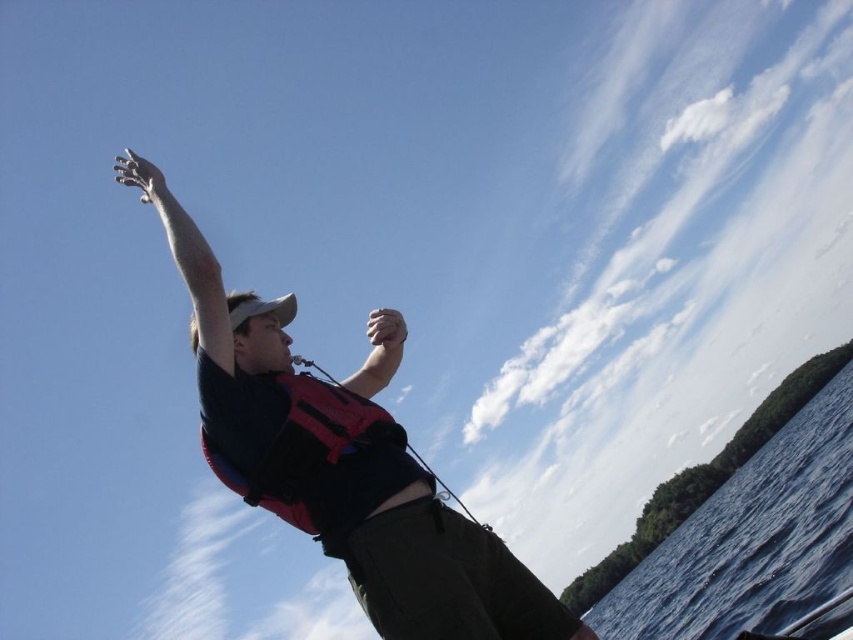
You are a photographer trying to capture the person in the scene. You want to frame the shot so that the red life vest at center and the blue liquid water at lower right are both visible. Based on their positions, which object should be placed on the left side of the frame?

The red life vest at center is to the left of blue liquid water at lower right, so the red life vest at center should be placed on the left side of the frame.